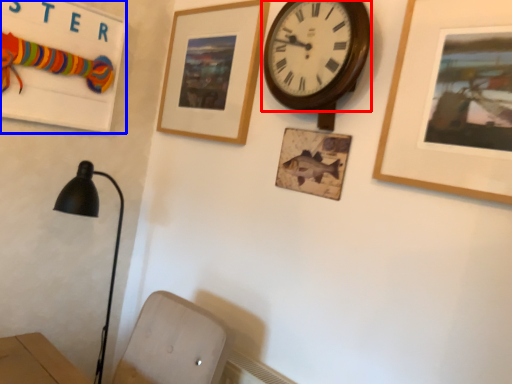
Question: Which of the following is the closest to the observer, wall clock (highlighted by a red box) or bulletin board (highlighted by a blue box)?

Choices:
 (A) wall clock
 (B) bulletin board

Answer: (A)